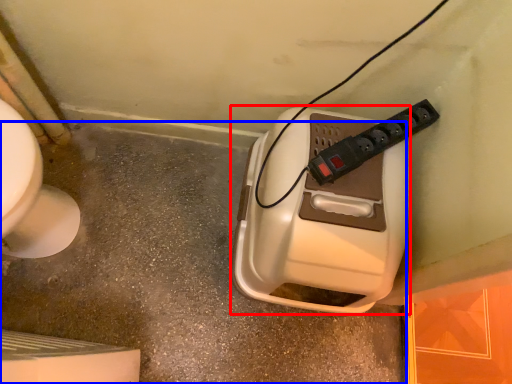
Question: Among these objects, which one is farthest to the camera, hand dryer (highlighted by a red box) or concrete (highlighted by a blue box)?

Choices:
 (A) hand dryer
 (B) concrete

Answer: (B)